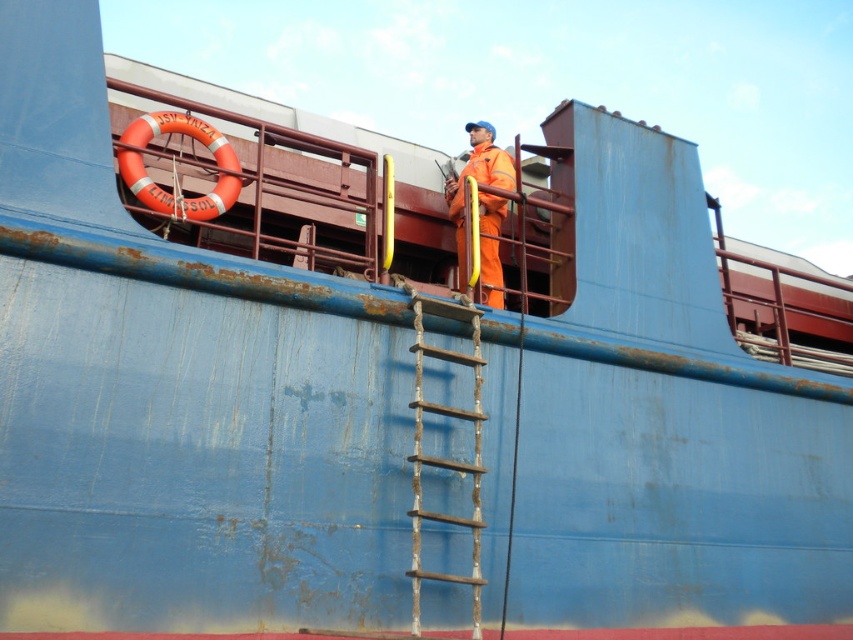
Question: Does rusty wood ladder at center appear over orange matte safety suit at center?

Choices:
 (A) yes
 (B) no

Answer: (B)

Question: Which point is closer to the camera taking this photo?

Choices:
 (A) (457, 358)
 (B) (474, 179)

Answer: (A)

Question: Which object is positioned farthest from the rusty wood ladder at center?

Choices:
 (A) orange matte life jacket at upper center
 (B) orange matte safety suit at center

Answer: (A)

Question: Does rusty wood ladder at center appear on the right side of orange matte life jacket at upper center?

Choices:
 (A) no
 (B) yes

Answer: (A)

Question: Which of these objects is positioned closest to the orange matte life jacket at upper center?

Choices:
 (A) rusty wood ladder at center
 (B) orange matte safety suit at center

Answer: (B)

Question: Does rusty wood ladder at center appear over orange matte safety suit at center?

Choices:
 (A) no
 (B) yes

Answer: (A)